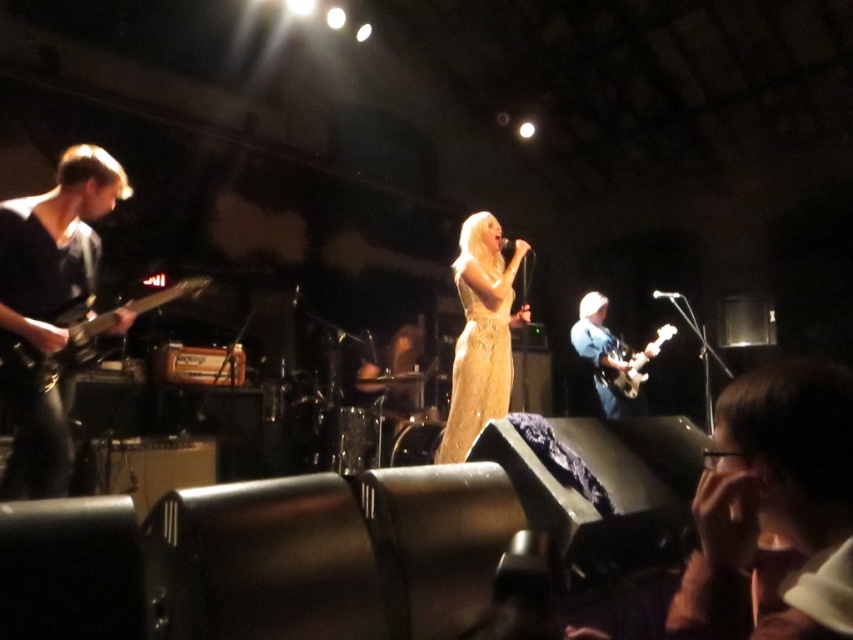
You are a stagehand setting up the lighting for the performance. You need to adjust the spotlight so it illuminates both the black matte guitar at left and the shiny black electric guitar at left. Which guitar should you aim the spotlight at first to ensure both are lit properly?

The black matte guitar at left is positioned over shiny black electric guitar at left. Therefore, you should aim the spotlight at the black matte guitar at left first to ensure the light reaches both guitars properly.

You are a photographer at the back of the venue. You need to capture a clear photo of both the gold shimmering dress at center and the shiny black electric guitar at left. Which object should you adjust your camera focus on first to ensure both are in frame?

The gold shimmering dress at center is wider than the shiny black electric guitar at left. Since the dress is wider, you should focus on it first to ensure the entire dress and the guitar fit within the frame.